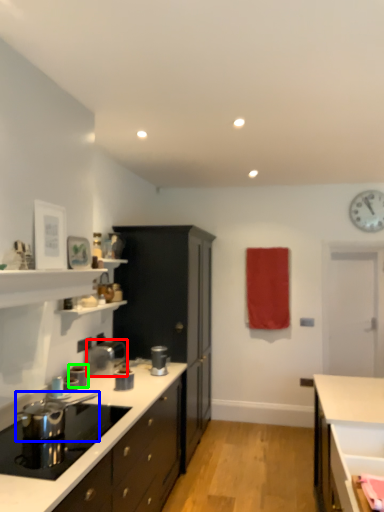
Question: Which is farther away from appliance (highlighted by a red box)? appliance (highlighted by a blue box) or kitchen appliance (highlighted by a green box)?

Choices:
 (A) appliance
 (B) kitchen appliance

Answer: (A)